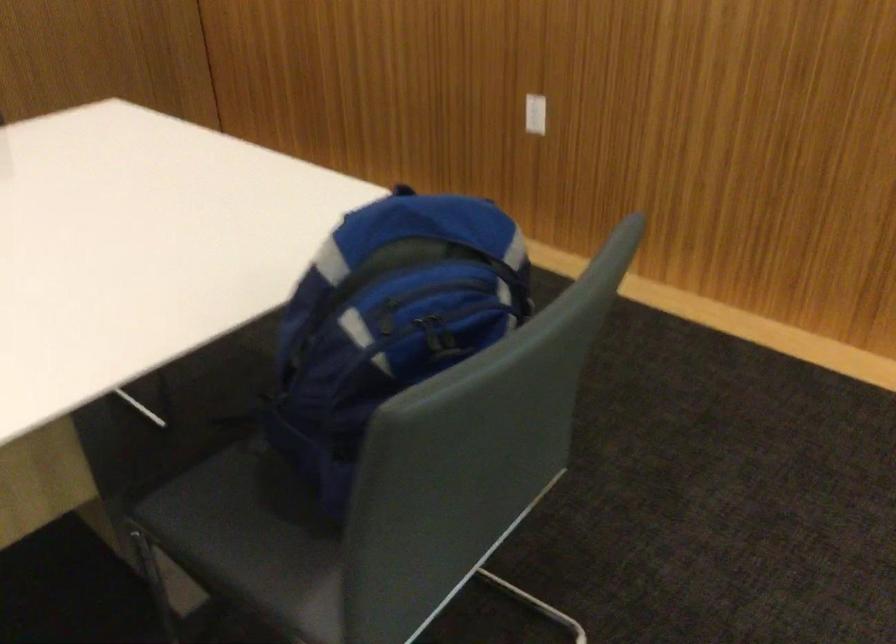
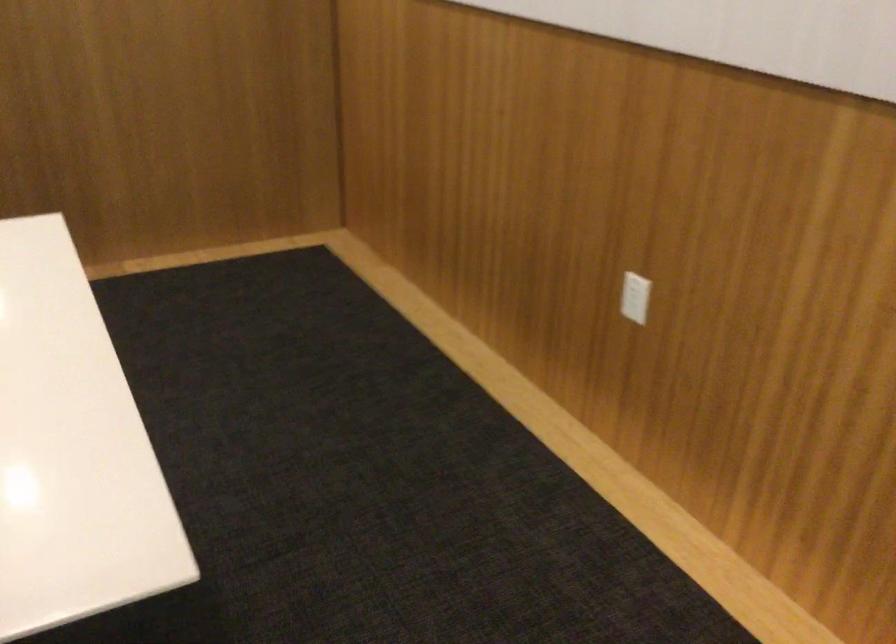
Question: The camera is either moving clockwise (left) or counter-clockwise (right) around the object. The first image is from the beginning of the video and the second image is from the end. Is the camera moving left or right when shooting the video?

Choices:
 (A) Left
 (B) Right

Answer: (B)